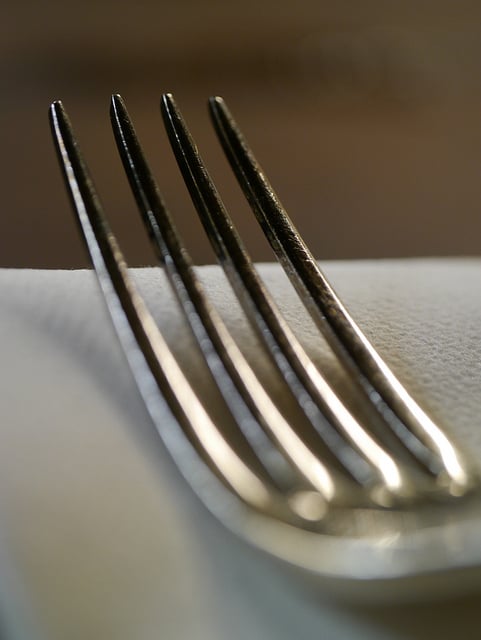
Locate an element on the screen. The height and width of the screenshot is (640, 481). napkin is located at coordinates (419, 379).